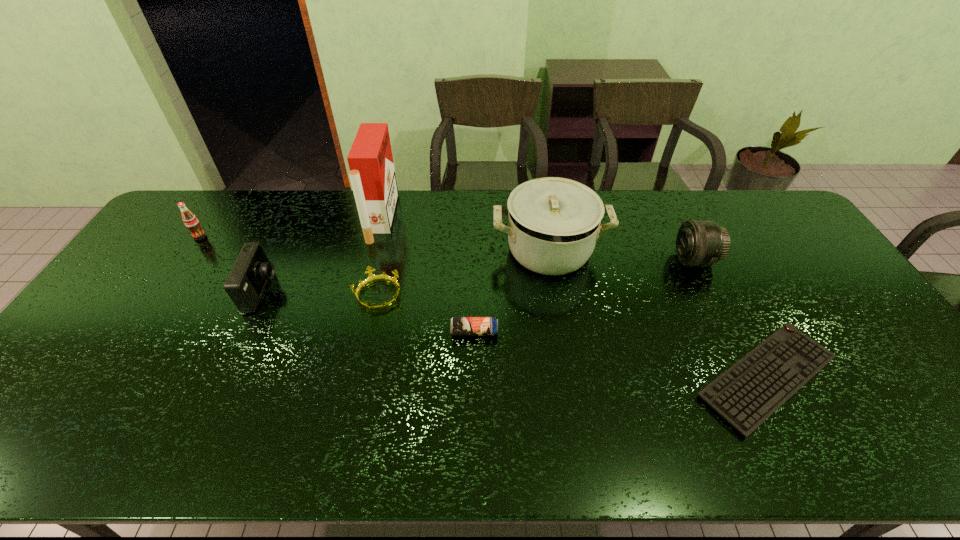
Identify which object is the third nearest to the tallest object. Please provide its 2D coordinates. Your answer should be formatted as a tuple, i.e. [(x, y)], where the tuple contains the x and y coordinates of a point satisfying the conditions above.

[(553, 223)]

Find the location of a particular element. blank area in the image that satisfies the following two spatial constraints: 1. on the front-facing side of the cigarette case; 2. on the left side of the crown is located at coordinates (362, 295).

The width and height of the screenshot is (960, 540). What are the coordinates of `vacant space that satisfies the following two spatial constraints: 1. on the front-facing side of the crown; 2. on the right side of the seventh object from right to left` in the screenshot? It's located at coord(260,295).

Identify the location of free spot that satisfies the following two spatial constraints: 1. on the front-facing side of the tallest object; 2. on the back side of the seventh shortest object. The width and height of the screenshot is (960, 540). tap(373, 250).

Find the location of a particular element. The width and height of the screenshot is (960, 540). vacant space that satisfies the following two spatial constraints: 1. on the front-facing side of the computer keyboard; 2. on the right side of the seventh object from right to left is located at coordinates (223, 377).

Locate an element on the screen. The image size is (960, 540). free point that satisfies the following two spatial constraints: 1. on the back side of the seventh shortest object; 2. on the right side of the crown is located at coordinates [x=388, y=250].

The image size is (960, 540). Find the location of `free space that satisfies the following two spatial constraints: 1. on the front-facing side of the second object from left to right; 2. on the right side of the crown`. free space that satisfies the following two spatial constraints: 1. on the front-facing side of the second object from left to right; 2. on the right side of the crown is located at coordinates (260, 295).

Where is `free location that satisfies the following two spatial constraints: 1. on the front-facing side of the telephoto lens; 2. on the back side of the shortest object`? This screenshot has width=960, height=540. free location that satisfies the following two spatial constraints: 1. on the front-facing side of the telephoto lens; 2. on the back side of the shortest object is located at coordinates (751, 377).

Locate an element on the screen. vacant space that satisfies the following two spatial constraints: 1. on the front side of the crown; 2. on the right side of the leftmost object is located at coordinates (160, 295).

Where is `vacant point that satisfies the following two spatial constraints: 1. on the front side of the computer keyboard; 2. on the right side of the crown`? The width and height of the screenshot is (960, 540). vacant point that satisfies the following two spatial constraints: 1. on the front side of the computer keyboard; 2. on the right side of the crown is located at coordinates (360, 377).